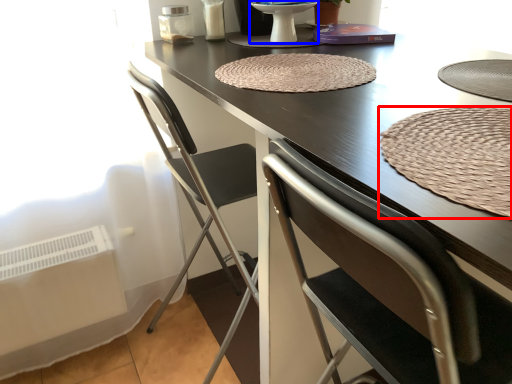
Question: Which point is closer to the camera, mat (highlighted by a red box) or round table (highlighted by a blue box)?

Choices:
 (A) mat
 (B) round table

Answer: (A)